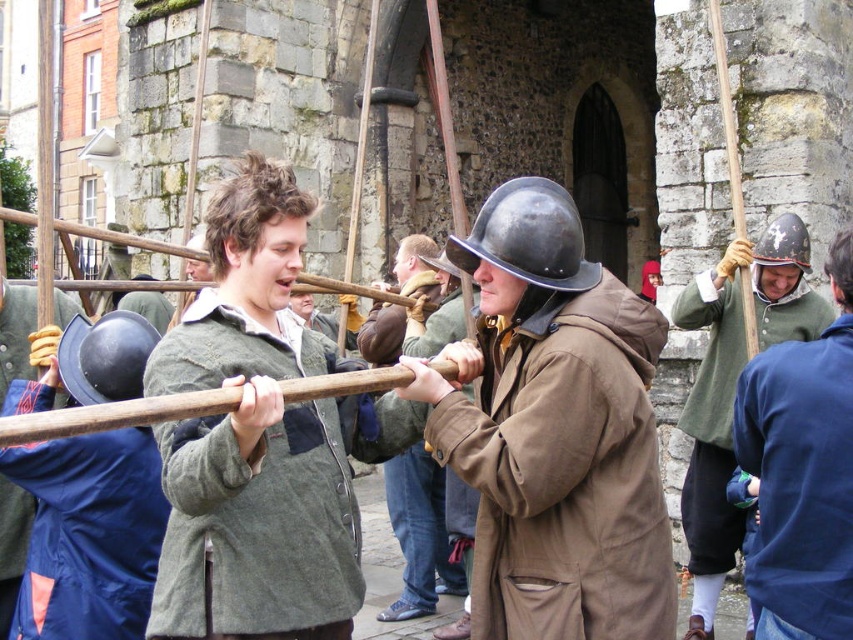
You are a photographer standing at the camera position. You want to take a closeup photo of the green woolen coat at center. The camera has a maximum zoom range of 20 meters. Can you capture a clear closeup without moving closer?

The green woolen coat at center is 20.46 meters away from the camera. Since the camera can only zoom up to 20 meters, it cannot reach the required distance. Therefore, you cannot capture a clear closeup without moving closer.

You are a costume designer preparing for a historical play. You have two props to place on a display stand. The brown leather coat at center and the matte black helmet at left. The stand can only hold items where the larger one is placed below the smaller one. Which prop should go on the bottom?

The brown leather coat at center is larger in size than the matte black helmet at left, so the brown leather coat at center should be placed on the bottom of the display stand.